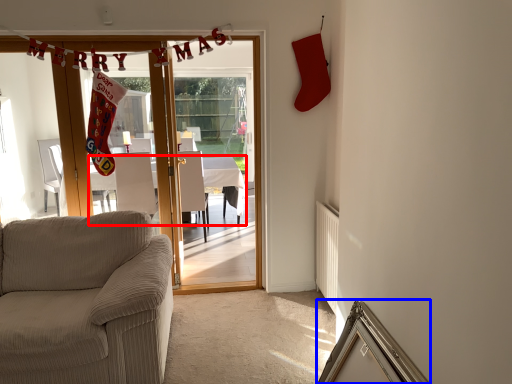
Question: Which of the following is the closest to the observer, table (highlighted by a red box) or picture frame (highlighted by a blue box)?

Choices:
 (A) table
 (B) picture frame

Answer: (B)